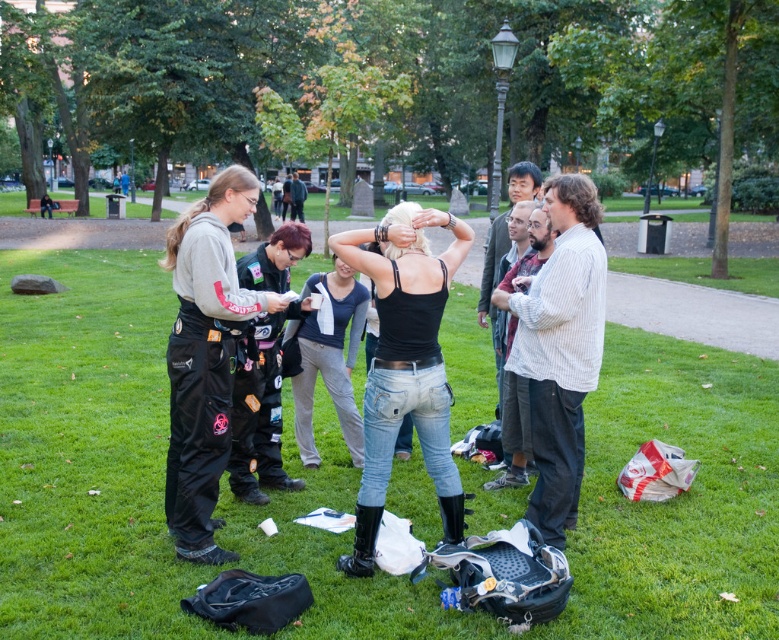
Which is above, black matte jumpsuit at center or white striped shirt at center?

white striped shirt at center is above.

Which is behind, point (404, 292) or point (594, 385)?

Positioned behind is point (594, 385).

Locate an element on the screen. The image size is (779, 640). black matte jumpsuit at center is located at coordinates (404, 364).

Can you confirm if green grass at center is positioned above black matte jumpsuit at center?

Actually, green grass at center is below black matte jumpsuit at center.

Looking at this image, can you confirm if green grass at center is wider than black matte jumpsuit at center?

Indeed, green grass at center has a greater width compared to black matte jumpsuit at center.

Locate an element on the screen. The height and width of the screenshot is (640, 779). green grass at center is located at coordinates (87, 452).

Does black matte pants at left appear on the left side of black matte tank top at center?

Correct, you'll find black matte pants at left to the left of black matte tank top at center.

Identify the location of black matte pants at left. The width and height of the screenshot is (779, 640). (205, 356).